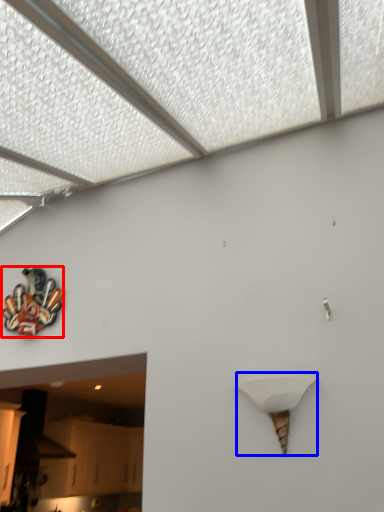
Question: Among these objects, which one is farthest to the camera, art (highlighted by a red box) or lamp (highlighted by a blue box)?

Choices:
 (A) art
 (B) lamp

Answer: (A)